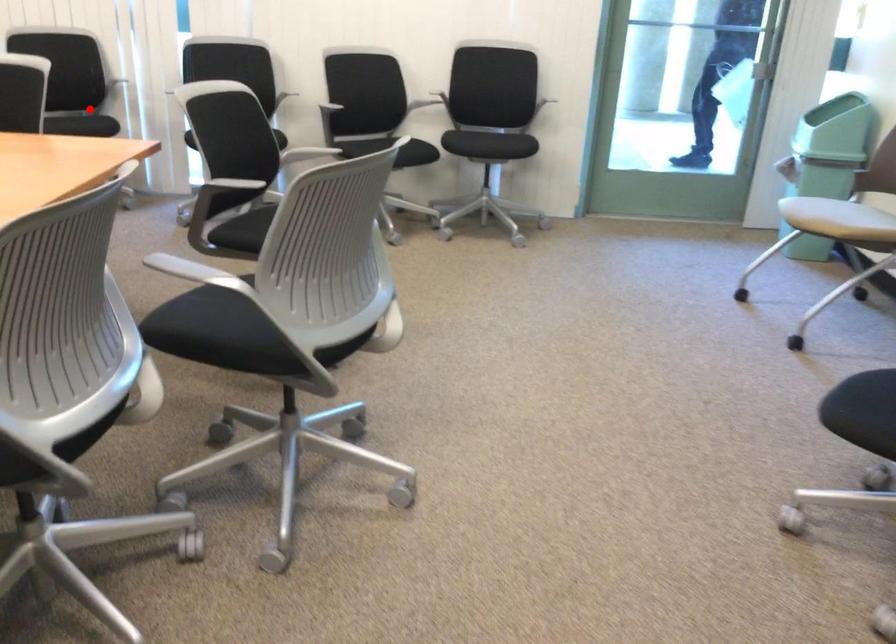
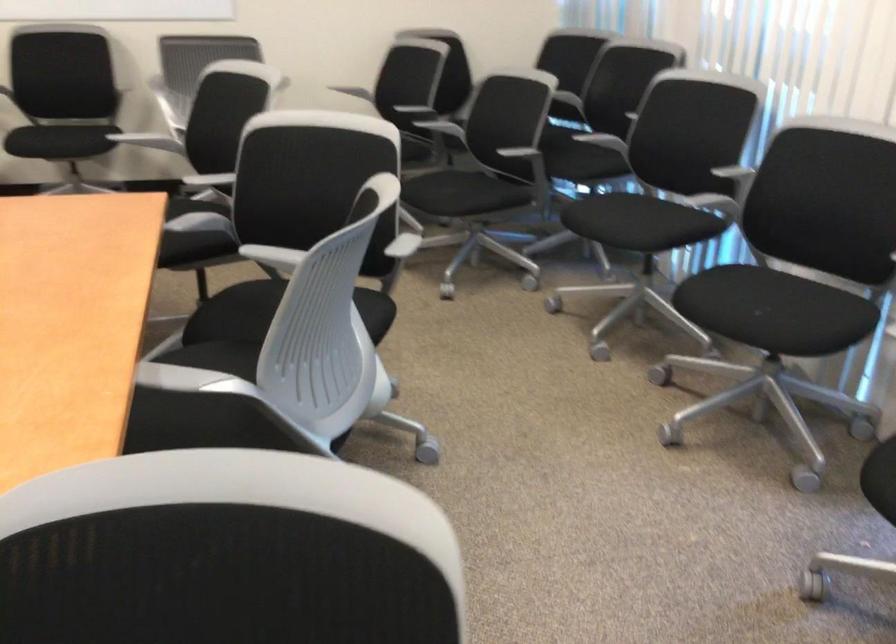
Question: A red point is marked in image1. In image2, is the corresponding 3D point closer to the camera or farther? Reply with the corresponding letter.

Choices:
 (A) The corresponding 3D point is closer.
 (B) The corresponding 3D point is farther.

Answer: (A)